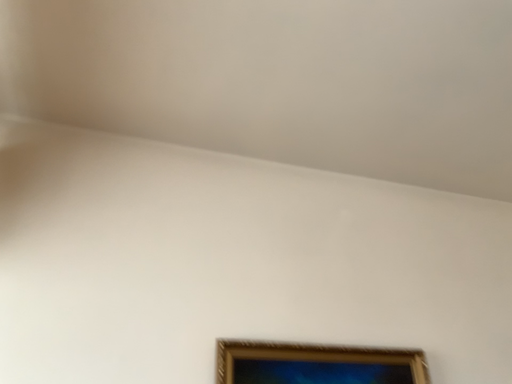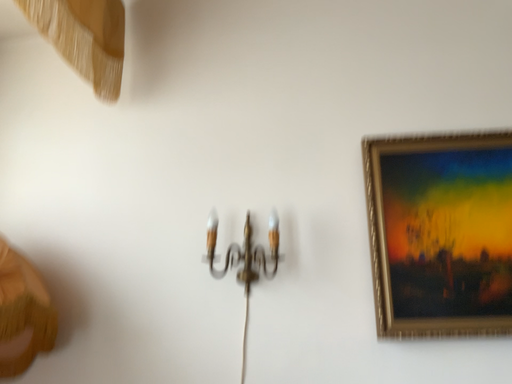
Question: How did the camera likely rotate when shooting the video?

Choices:
 (A) rotated left
 (B) rotated right

Answer: (A)